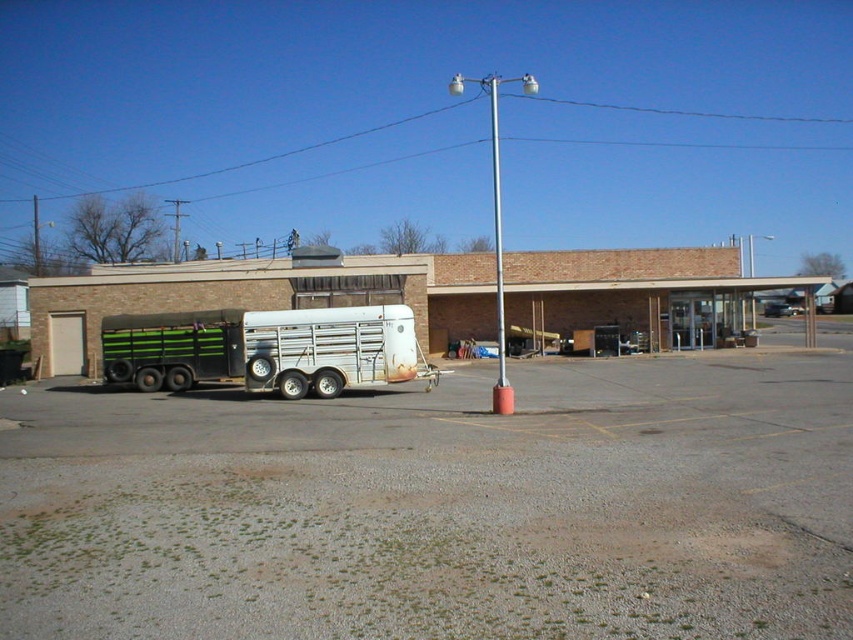
Question: Where is green striped metal trailer truck at left located in relation to red painted metal pole at center in the image?

Choices:
 (A) above
 (B) below

Answer: (B)

Question: Does gravel at lower left have a smaller size compared to red painted metal pole at center?

Choices:
 (A) no
 (B) yes

Answer: (B)

Question: Which object is the farthest from the green striped metal trailer truck at left?

Choices:
 (A) gravel at lower left
 (B) red painted metal pole at center

Answer: (B)

Question: Which object is farther from the camera taking this photo?

Choices:
 (A) green striped metal trailer truck at left
 (B) gravel at lower left
 (C) red painted metal pole at center

Answer: (A)

Question: Which object is the farthest from the gravel at lower left?

Choices:
 (A) red painted metal pole at center
 (B) green striped metal trailer truck at left

Answer: (A)

Question: Is the position of green striped metal trailer truck at left more distant than that of red painted metal pole at center?

Choices:
 (A) yes
 (B) no

Answer: (A)